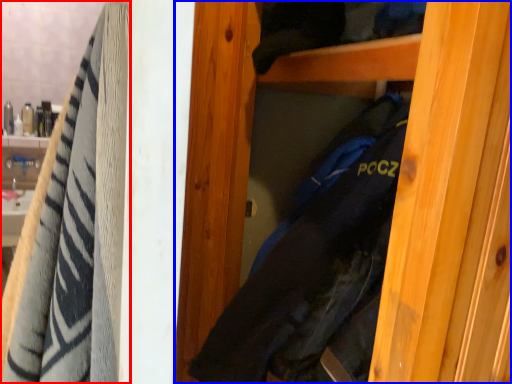
Question: Which object appears closest to the camera in this image, towel (highlighted by a red box) or door (highlighted by a blue box)?

Choices:
 (A) towel
 (B) door

Answer: (B)